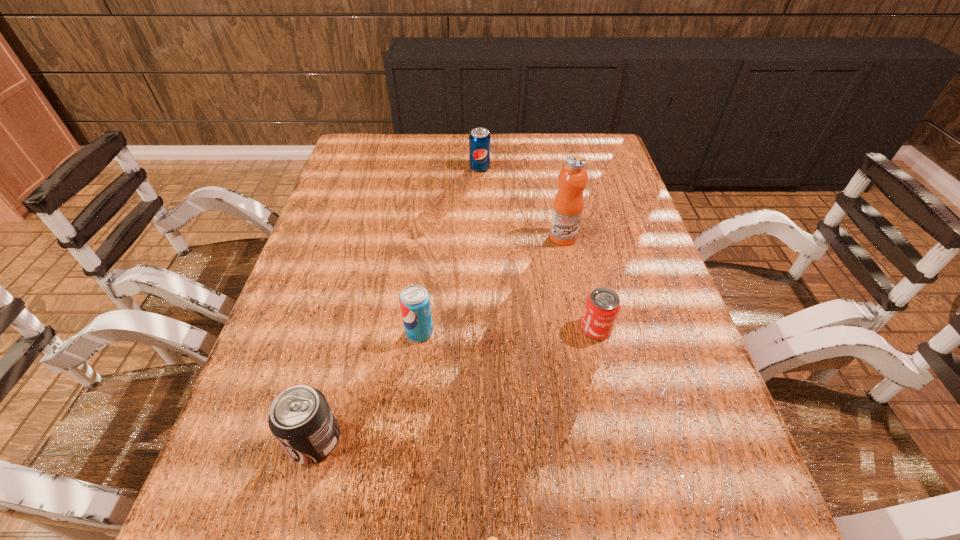
Identify the location of fruit juice. Image resolution: width=960 pixels, height=540 pixels. (568, 205).

What are the coordinates of `the tallest object` in the screenshot? It's located at (568, 205).

Where is `the rightmost soda can`? the rightmost soda can is located at coordinates (479, 140).

This screenshot has height=540, width=960. I want to click on the farthest soda can, so click(x=479, y=140).

Identify the location of the leftmost soda can. Image resolution: width=960 pixels, height=540 pixels. (300, 418).

Where is `the leftmost object`? The image size is (960, 540). the leftmost object is located at coordinates (300, 418).

The width and height of the screenshot is (960, 540). Identify the location of the fifth object from right to left. (x=414, y=300).

At what (x,y) coordinates should I click in order to perform the action: click on the second nearest soda can. Please return your answer as a coordinate pair (x, y). Looking at the image, I should click on (414, 300).

The height and width of the screenshot is (540, 960). I want to click on the fifth tallest object, so click(602, 307).

What are the coordinates of `free region located 0.100m on the back of the fruit juice` in the screenshot? It's located at (557, 206).